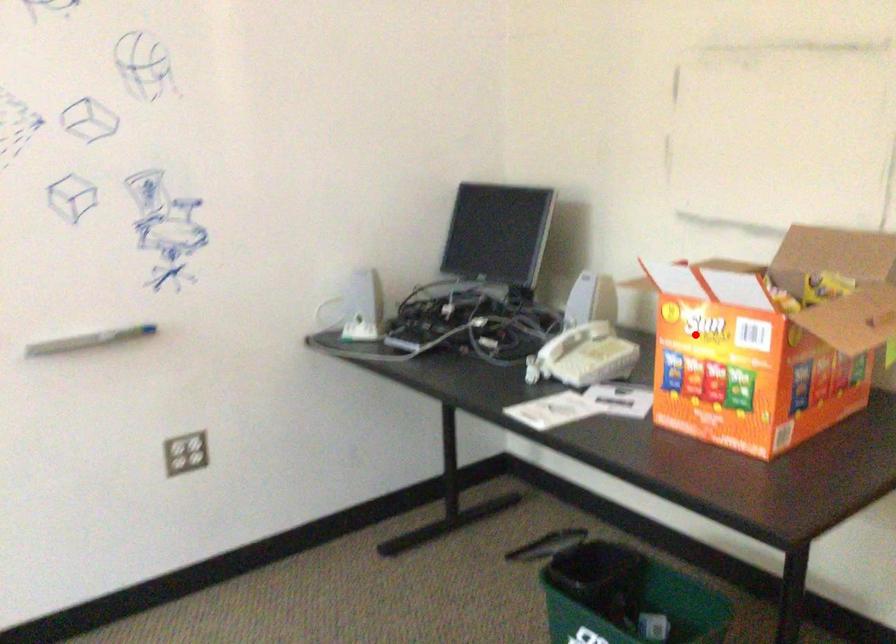
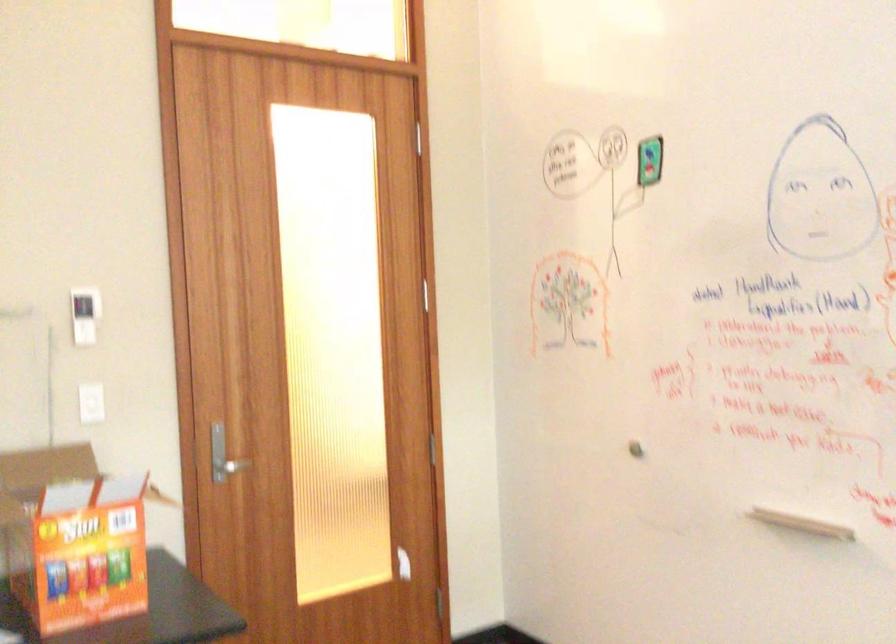
Question: I am providing you with two images of the same scene from different viewpoints. Given a red point in image1, look at the same physical point in image2. Is it:

Choices:
 (A) Closer to the viewpoint
 (B) Farther from the viewpoint

Answer: (B)